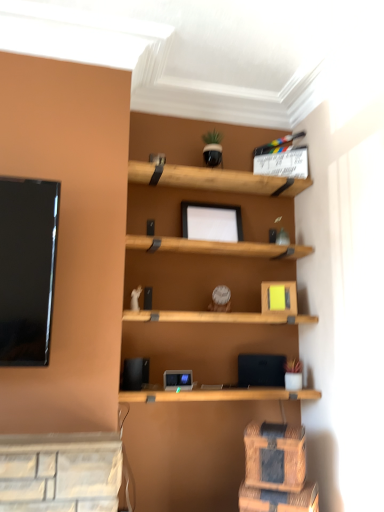
Question: Is woven wood drawer at lower right, the 1th drawer positioned from the top, wider or thinner than blue fabric drawer at lower right, positioned as the 2th drawer in top-to-bottom order?

Choices:
 (A) wide
 (B) thin

Answer: (B)

Question: In terms of height, does woven wood drawer at lower right, acting as the 2th drawer starting from the bottom, look taller or shorter compared to blue fabric drawer at lower right, positioned as the 2th drawer in top-to-bottom order?

Choices:
 (A) short
 (B) tall

Answer: (B)

Question: Considering the positions of woven wood drawer at lower right, acting as the 2th drawer starting from the bottom, and blue fabric drawer at lower right, positioned as the 2th drawer in top-to-bottom order, in the image, is woven wood drawer at lower right, acting as the 2th drawer starting from the bottom, bigger or smaller than blue fabric drawer at lower right, positioned as the 2th drawer in top-to-bottom order,?

Choices:
 (A) big
 (B) small

Answer: (B)

Question: In terms of size, does blue fabric drawer at lower right, the first drawer ordered from the bottom, appear bigger or smaller than woven wood drawer at lower right, the 1th drawer positioned from the top?

Choices:
 (A) big
 (B) small

Answer: (A)

Question: Considering the positions of blue fabric drawer at lower right, positioned as the 2th drawer in top-to-bottom order, and woven wood drawer at lower right, acting as the 2th drawer starting from the bottom, in the image, is blue fabric drawer at lower right, positioned as the 2th drawer in top-to-bottom order, wider or thinner than woven wood drawer at lower right, acting as the 2th drawer starting from the bottom,?

Choices:
 (A) thin
 (B) wide

Answer: (B)

Question: In terms of height, does blue fabric drawer at lower right, positioned as the 2th drawer in top-to-bottom order, look taller or shorter compared to woven wood drawer at lower right, the 1th drawer positioned from the top?

Choices:
 (A) tall
 (B) short

Answer: (B)

Question: Is blue fabric drawer at lower right, the first drawer ordered from the bottom, situated inside woven wood drawer at lower right, the 1th drawer positioned from the top, or outside?

Choices:
 (A) inside
 (B) outside

Answer: (B)